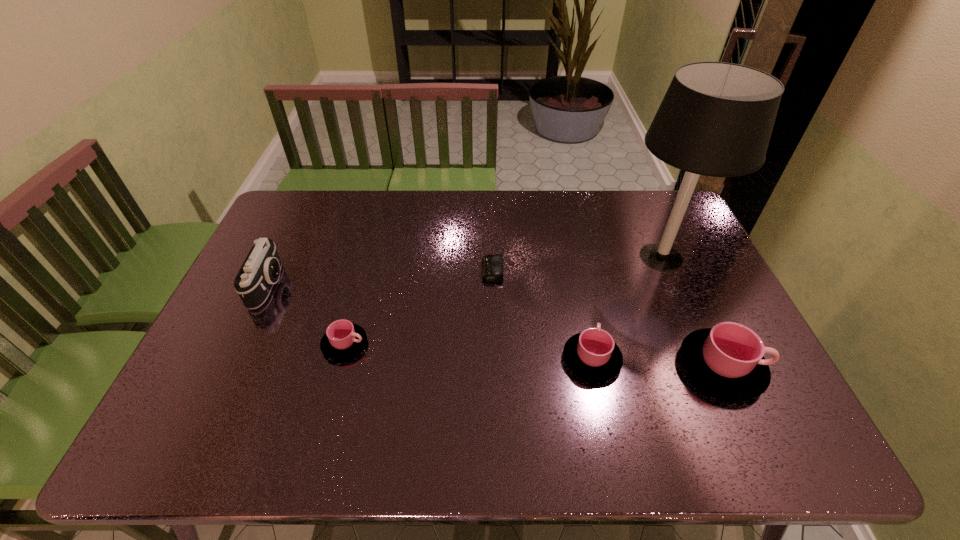
Where is `the second shortest object`? This screenshot has width=960, height=540. the second shortest object is located at coordinates (343, 339).

Identify the location of the shortest cup. Image resolution: width=960 pixels, height=540 pixels. (343, 339).

I want to click on the fourth tallest object, so click(x=592, y=354).

Image resolution: width=960 pixels, height=540 pixels. Identify the location of the second cup from right to left. (592, 354).

Find the location of `the rightmost cup`. the rightmost cup is located at coordinates (728, 359).

In order to click on the fourth shortest object in this screenshot , I will do `click(728, 359)`.

Image resolution: width=960 pixels, height=540 pixels. Identify the location of the second tallest object. (260, 271).

In order to click on camera in this screenshot , I will do `click(260, 271)`.

Identify the location of the third object from left to right. The height and width of the screenshot is (540, 960). (492, 265).

Find the location of a particular element. alarm clock is located at coordinates (492, 265).